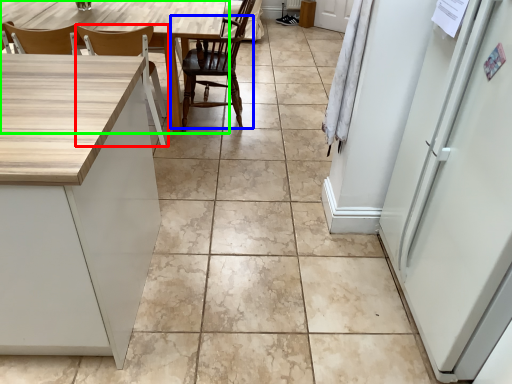
Question: Considering the real-world distances, which object is closest to chair (highlighted by a red box)? chair (highlighted by a blue box) or table (highlighted by a green box).

Choices:
 (A) chair
 (B) table

Answer: (B)